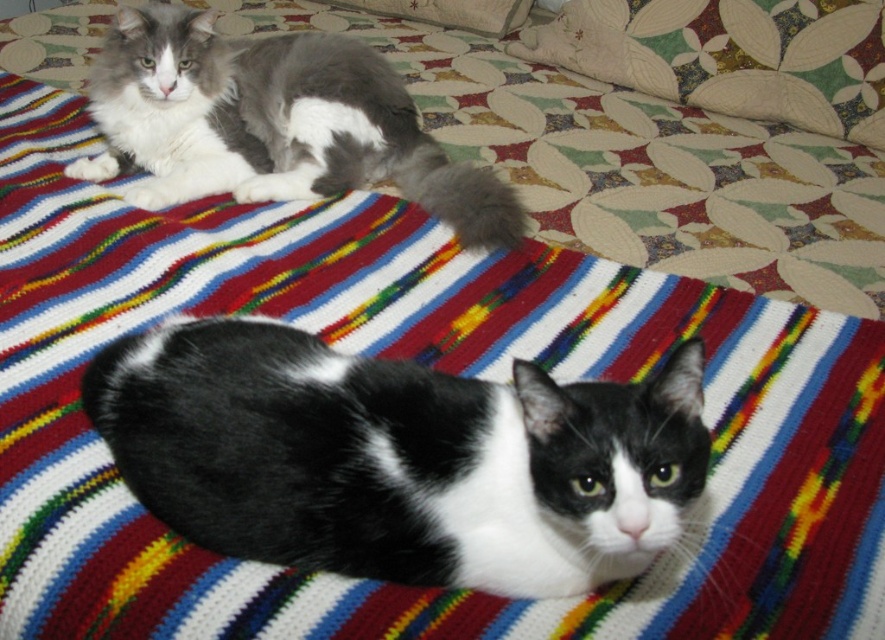
You are looking at the image of two cats on a striped blanket. There are two points marked in the image. The first point is at coordinate point (182, 444) and the second point is at coordinate point (775, 61). Which of these two points is closer to you?

Point (182, 444) is closer to the viewer than point (775, 61).

You are standing in front of the blanket and want to place a small toy at the exact location where the gray and white fur cat at upper left is currently resting. What are the coordinates of that location?

The coordinates of the gray and white fur cat at upper left are at point (273,124).

You are a photographer trying to capture both cats in a single shot. Given that the black and white fur cat at lower center and the gray and white fur cat at upper left are different in size, which cat would you need to position closer to the camera to make them appear the same size in the photo?

To make the black and white fur cat at lower center and the gray and white fur cat at upper left appear the same size in the photo, you should position the smaller black and white fur cat at lower center closer to the camera since it is smaller than the gray and white fur cat at upper left.